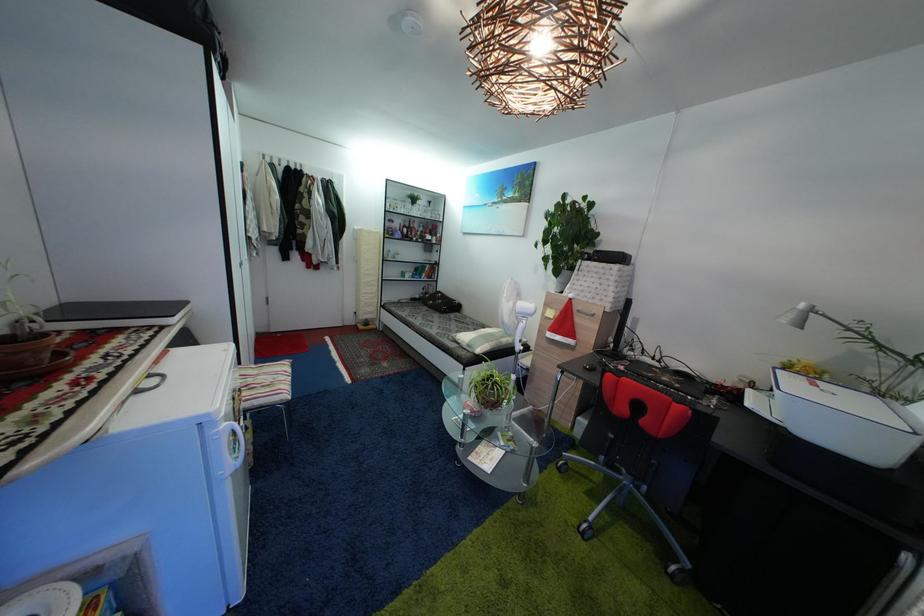
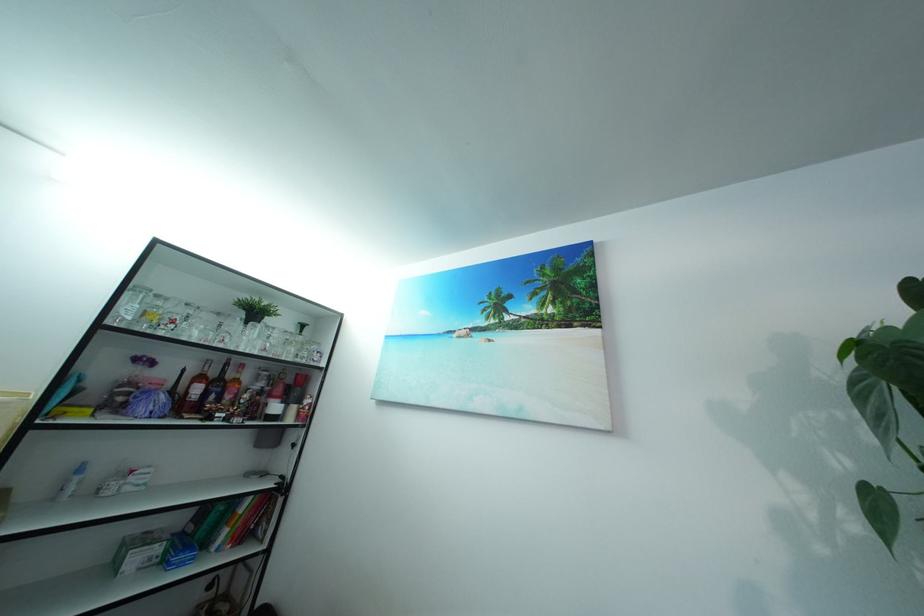
Locate, in the second image, the point that corresponds to [418,236] in the first image.

(226, 391)